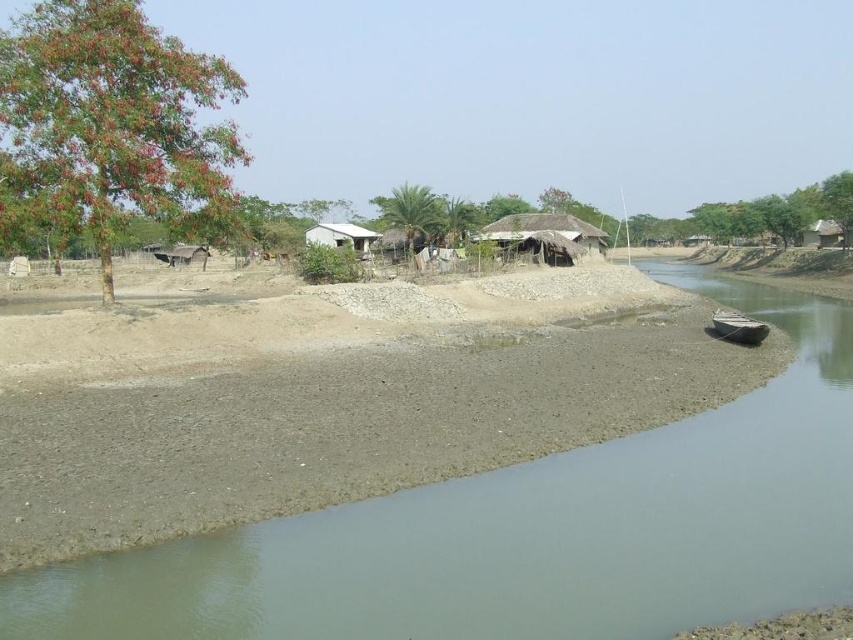
From the picture: Is green leafy palm tree at center to the right of white matte house at center from the viewer's perspective?

Indeed, green leafy palm tree at center is positioned on the right side of white matte house at center.

Between green leafy palm tree at center and white matte house at center, which one is positioned lower?

white matte house at center is lower down.

Between point (419, 189) and point (363, 252), which one is positioned in front?

Positioned in front is point (419, 189).

The image size is (853, 640). What are the coordinates of `green leafy palm tree at center` in the screenshot? It's located at (410, 216).

Who is lower down, thatched straw hut at center or white matte house at center?

Positioned lower is white matte house at center.

Can you confirm if thatched straw hut at center is thinner than white matte house at center?

Incorrect, thatched straw hut at center's width is not less than white matte house at center's.

You are a GUI agent. You are given a task and a screenshot of the screen. Output one action in this format:
    pyautogui.click(x=<x>, y=<y>)
    Task: Click on the thatched straw hut at center
    This screenshot has width=853, height=640.
    Given the screenshot: What is the action you would take?
    pyautogui.click(x=544, y=236)

The height and width of the screenshot is (640, 853). What are the coordinates of `brown dirt river at lower left` in the screenshot? It's located at (527, 531).

Between brown dirt river at lower left and green leafy tree at upper left, which one has more height?

Standing taller between the two is green leafy tree at upper left.

Where is `brown dirt river at lower left`? Image resolution: width=853 pixels, height=640 pixels. brown dirt river at lower left is located at coordinates (527, 531).

Image resolution: width=853 pixels, height=640 pixels. In order to click on brown dirt river at lower left in this screenshot , I will do `click(527, 531)`.